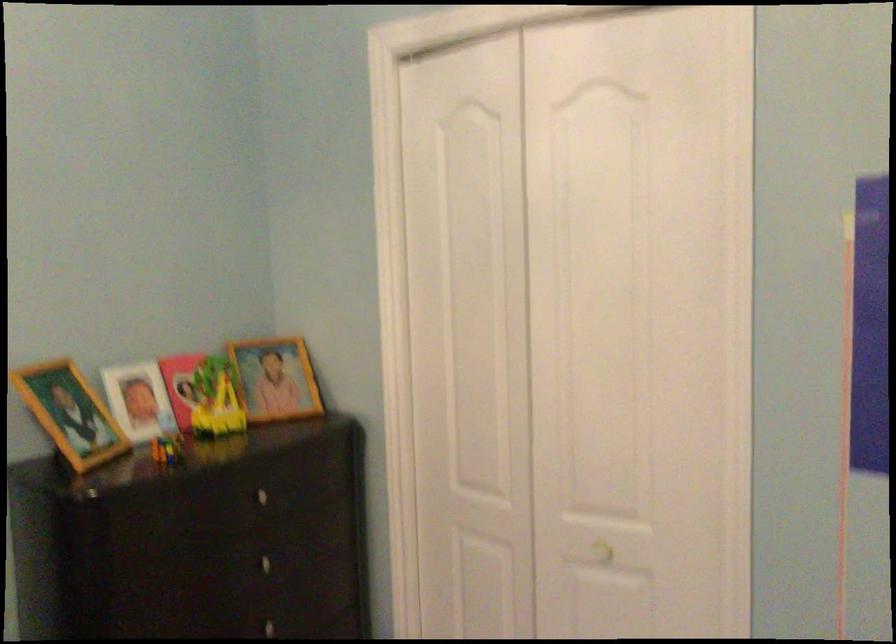
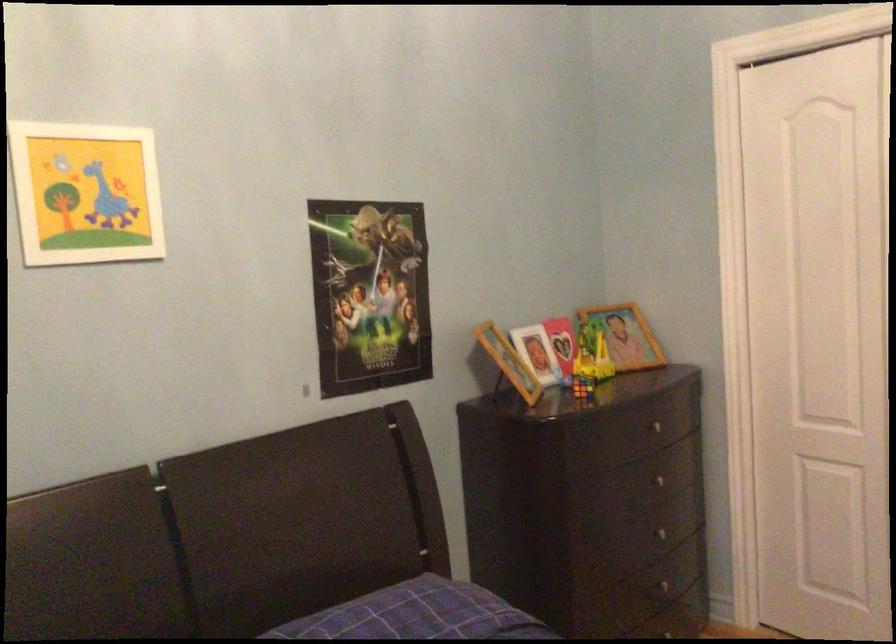
What movement of the cameraman would produce the second image?

The cameraman moved toward left, backward.